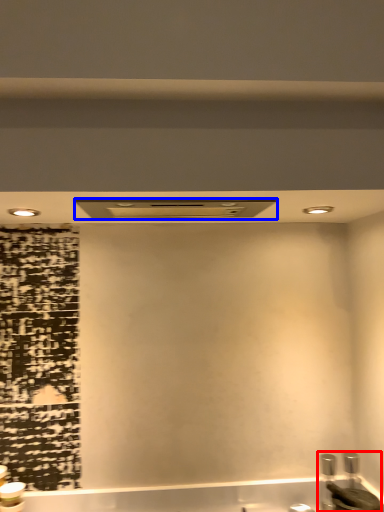
Question: Among these objects, which one is farthest to the camera, sink (highlighted by a red box) or exhaust hood (highlighted by a blue box)?

Choices:
 (A) sink
 (B) exhaust hood

Answer: (A)